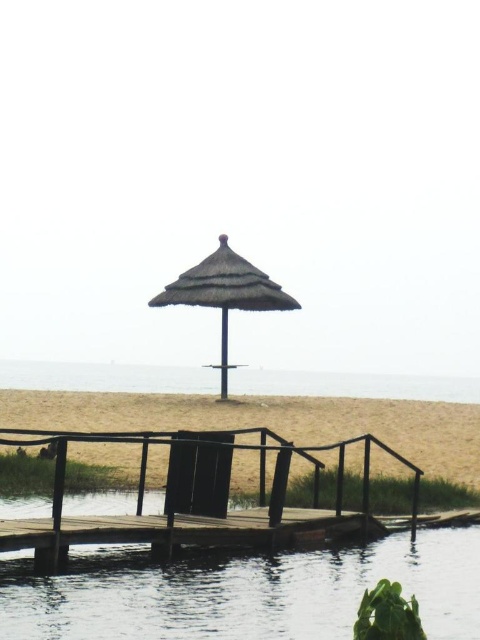
Question: Which object is positioned closest to the brown woven pole at center?

Choices:
 (A) clear water at center
 (B) transparent water at dock center
 (C) black woven beach chair at center

Answer: (A)

Question: Is black woven beach chair at center wider than brown woven pole at center?

Choices:
 (A) yes
 (B) no

Answer: (A)

Question: Estimate the real-world distances between objects in this image. Which object is farther from the beige sand beach at lower center?

Choices:
 (A) transparent water at dock center
 (B) black woven beach chair at center
 (C) brown woven pole at center
 (D) clear water at center

Answer: (A)

Question: Is transparent water at dock center smaller than thatched straw umbrella at center?

Choices:
 (A) no
 (B) yes

Answer: (B)

Question: Is transparent water at dock center below black woven beach chair at center?

Choices:
 (A) yes
 (B) no

Answer: (A)

Question: Which of the following is the farthest from the observer?

Choices:
 (A) brown woven pole at center
 (B) black woven beach chair at center
 (C) transparent water at dock center
 (D) thatched straw umbrella at center

Answer: (A)